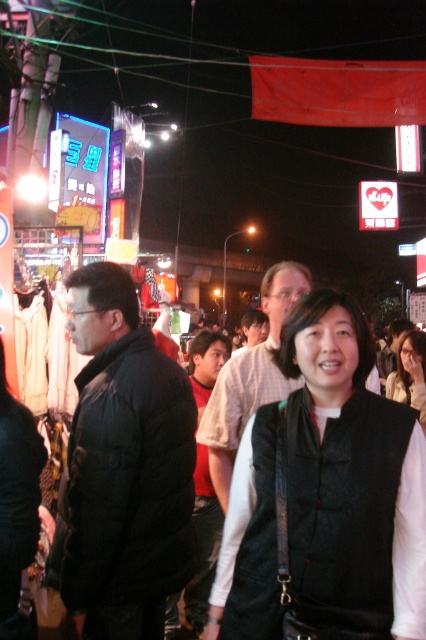
Question: Which point is farther to the camera?

Choices:
 (A) light brown shirt at center
 (B) black matte vest at center
 (C) matte black shirt at center
 (D) black leather vest at center

Answer: (C)

Question: Estimate the real-world distances between objects in this image. Which object is farther from the black leather vest at center?

Choices:
 (A) black puffer jacket at center
 (B) black matte vest at center
 (C) black fabric vest at center

Answer: (B)

Question: Is the position of light brown shirt at center more distant than that of black matte vest at center?

Choices:
 (A) no
 (B) yes

Answer: (A)

Question: Does black puffer jacket at center appear on the left side of light brown shirt at center?

Choices:
 (A) no
 (B) yes

Answer: (B)

Question: Is black leather vest at center to the left of matte black shirt at center from the viewer's perspective?

Choices:
 (A) no
 (B) yes

Answer: (B)

Question: Which object is the farthest from the light brown shirt at center?

Choices:
 (A) black fabric vest at center
 (B) black puffer jacket at center
 (C) black leather vest at center
 (D) black matte vest at center

Answer: (D)